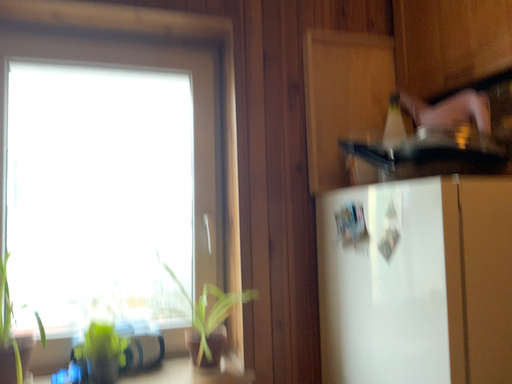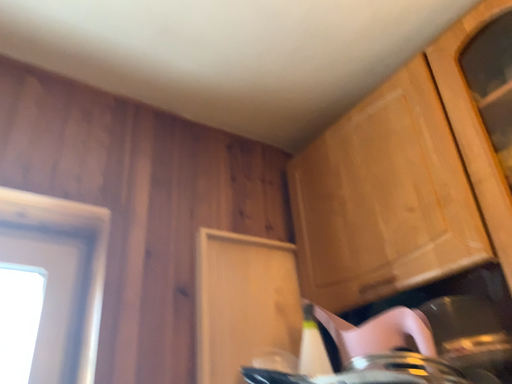
Question: How did the camera likely rotate when shooting the video?

Choices:
 (A) rotated upward
 (B) rotated downward

Answer: (A)